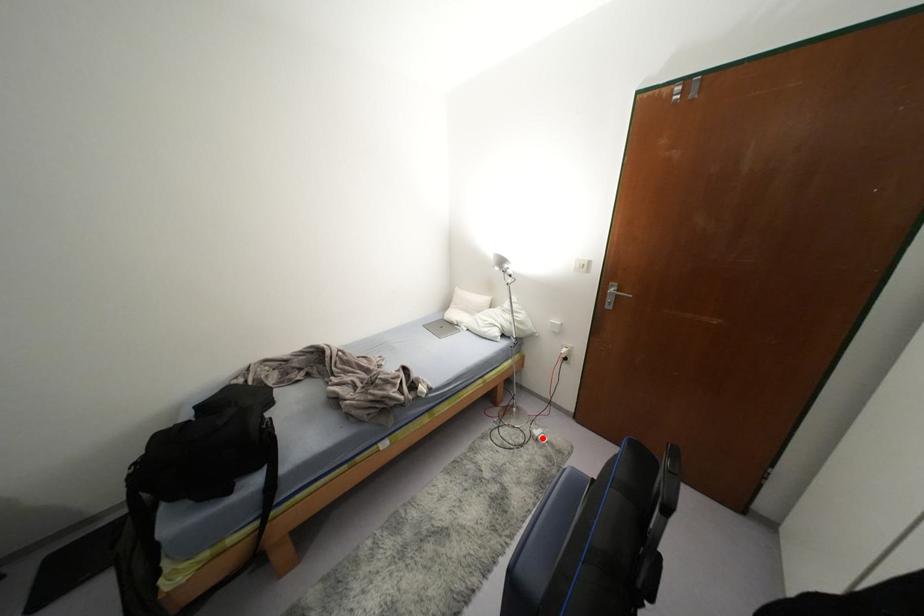
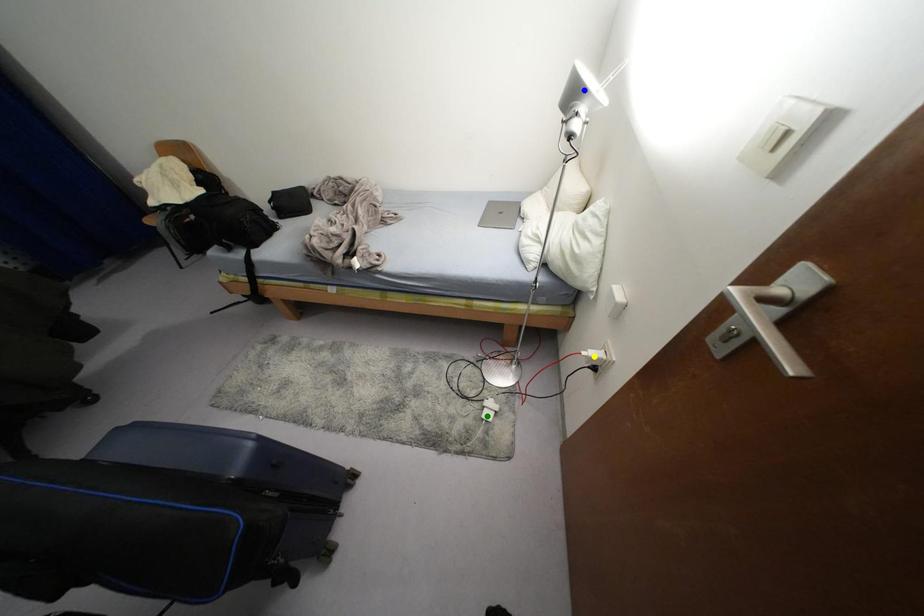
Question: I am providing you with two images of the same scene from different viewpoints. A red point is marked on the first image. You are given multiple points on the second image. Which mark in image 2 goes with the point in image 1?

Choices:
 (A) green point
 (B) yellow point
 (C) blue point

Answer: (A)